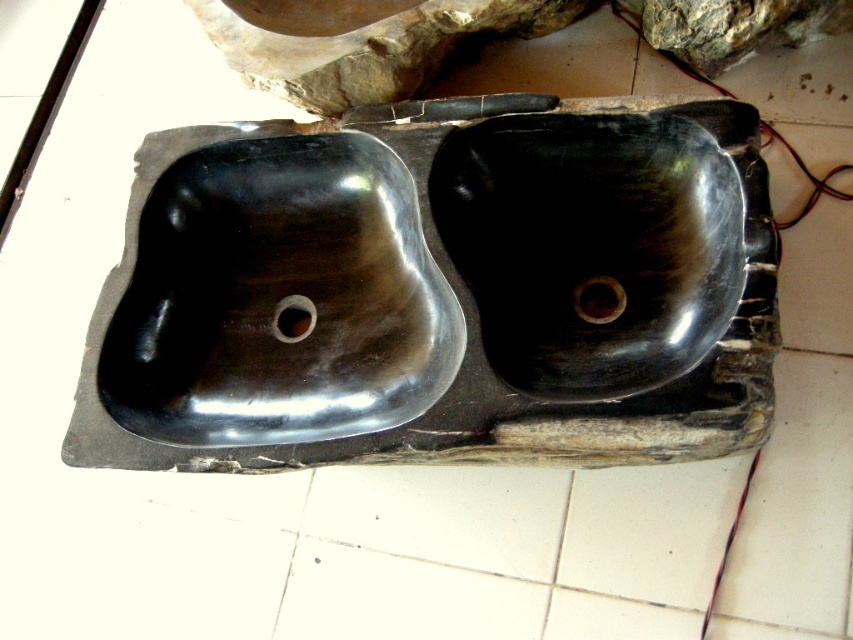
Does black polished sinks at center have a lesser width compared to black polished stone sink at center?

Incorrect, black polished sinks at center's width is not less than black polished stone sink at center's.

Is black polished sinks at center to the left of black polished stone sink at center from the viewer's perspective?

Incorrect, black polished sinks at center is not on the left side of black polished stone sink at center.

Is point (83, 417) more distant than point (366, 308)?

That is False.

Identify the location of black polished sinks at center. The image size is (853, 640). (438, 291).

Where is `black polished sinks at center`? The width and height of the screenshot is (853, 640). black polished sinks at center is located at coordinates (438, 291).

Can you confirm if black polished sinks at center is bigger than black marble stone at upper center?

Yes, black polished sinks at center is bigger than black marble stone at upper center.

Identify the location of black polished sinks at center. (438, 291).

You are a GUI agent. You are given a task and a screenshot of the screen. Output one action in this format:
    pyautogui.click(x=<x>, y=<y>)
    Task: Click on the black polished sinks at center
    
    Given the screenshot: What is the action you would take?
    pyautogui.click(x=438, y=291)

Is black polished stone sink at center to the left of black marble stone at upper center from the viewer's perspective?

Indeed, black polished stone sink at center is positioned on the left side of black marble stone at upper center.

Is black polished stone sink at center thinner than black marble stone at upper center?

Yes.

Is point (370, 288) less distant than point (358, 35)?

No, (370, 288) is behind (358, 35).

Image resolution: width=853 pixels, height=640 pixels. Identify the location of black polished stone sink at center. (279, 298).